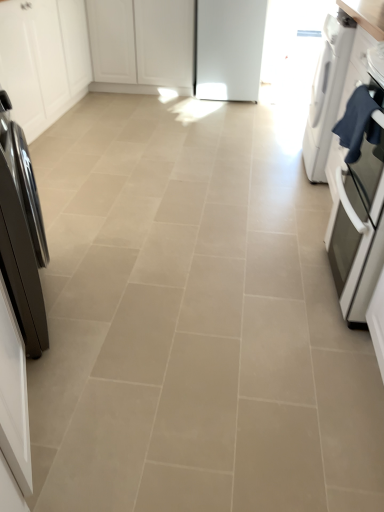
Locate an element on the screen. Image resolution: width=384 pixels, height=512 pixels. free space behind white glossy dryer at right, positioned as the first home appliance in top-to-bottom order is located at coordinates (279, 141).